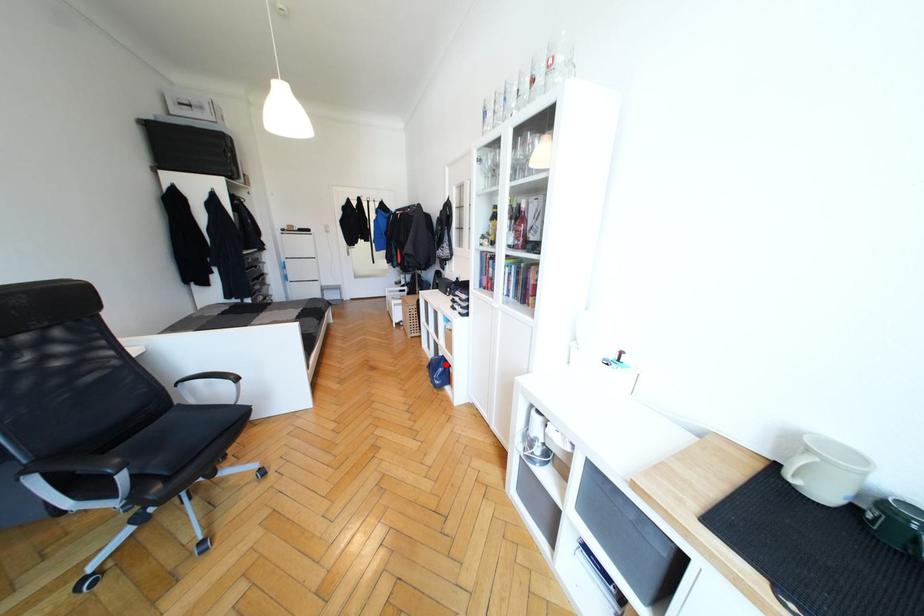
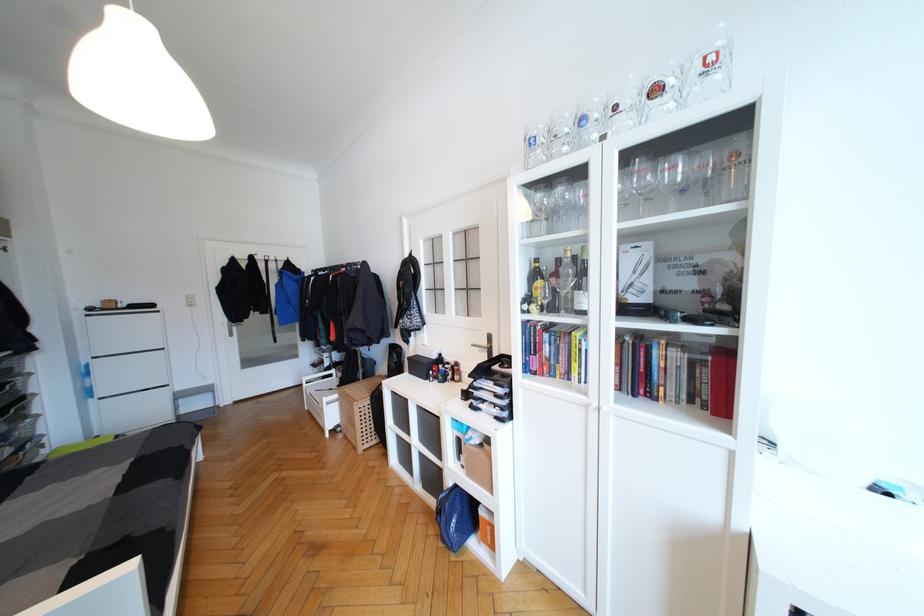
Question: I am providing you with two images of the same scene from different viewpoints. Image1 has a red point marked. In image2, the corresponding 3D location appears at what relative position? Reply with the corresponding letter.

Choices:
 (A) Closer
 (B) Farther

Answer: (B)